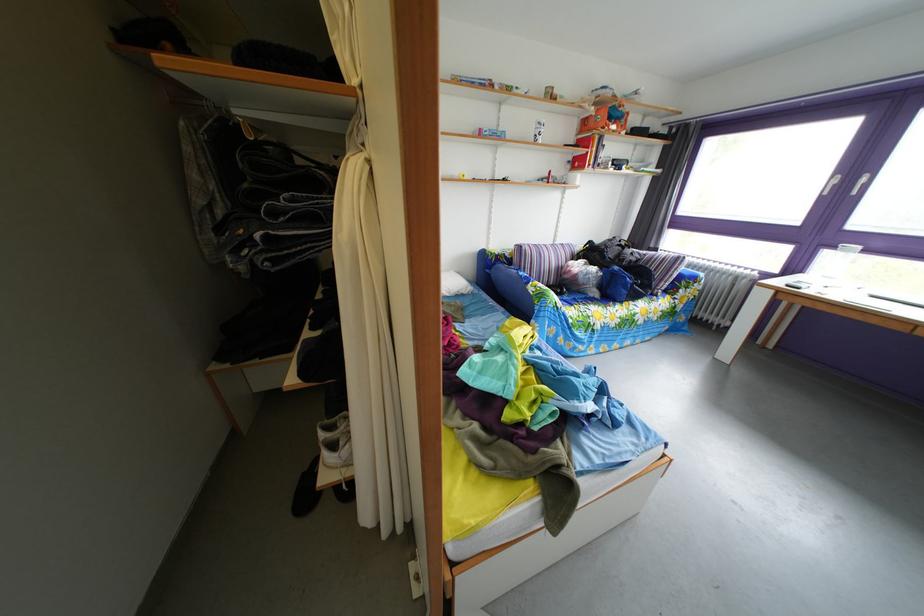
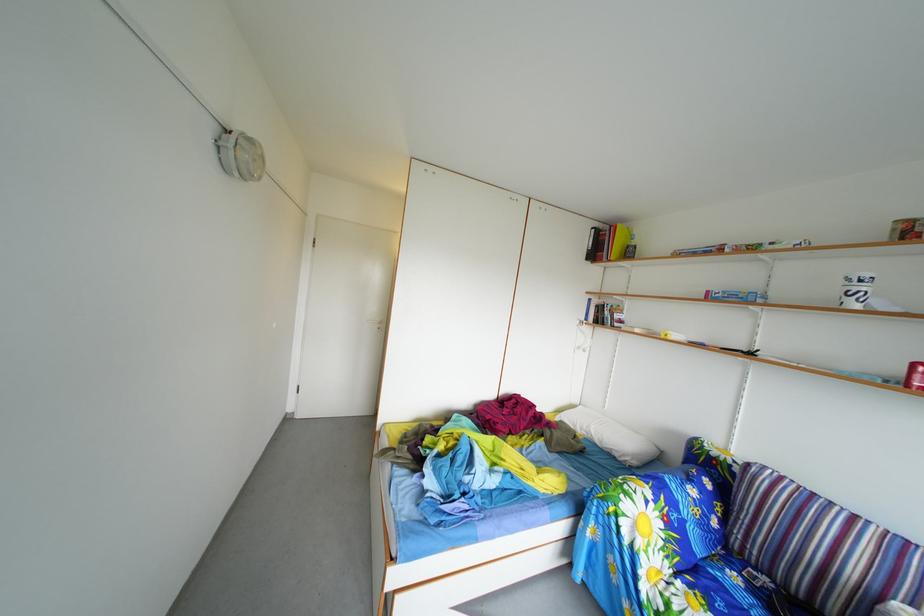
Find the pixel in the second image that matches the point at 551,132 in the first image.

(859, 288)